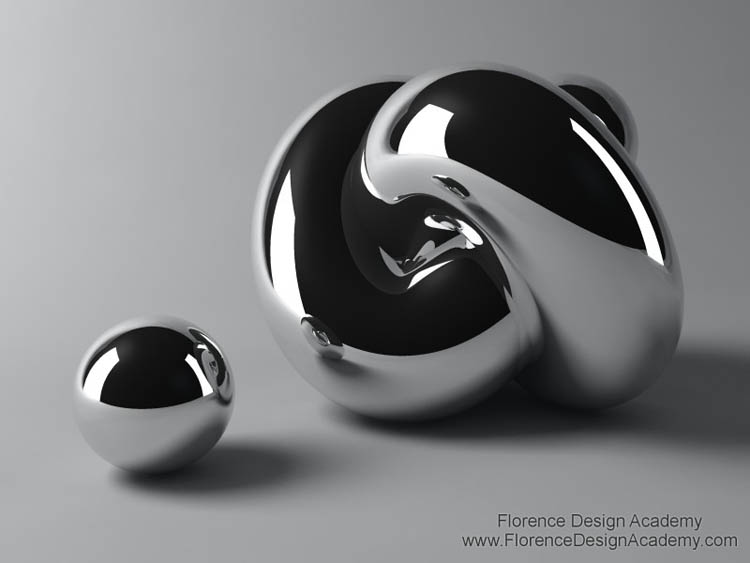
This screenshot has width=750, height=563. What are the coordinates of `artistic chrome ball` in the screenshot? It's located at (445, 251).